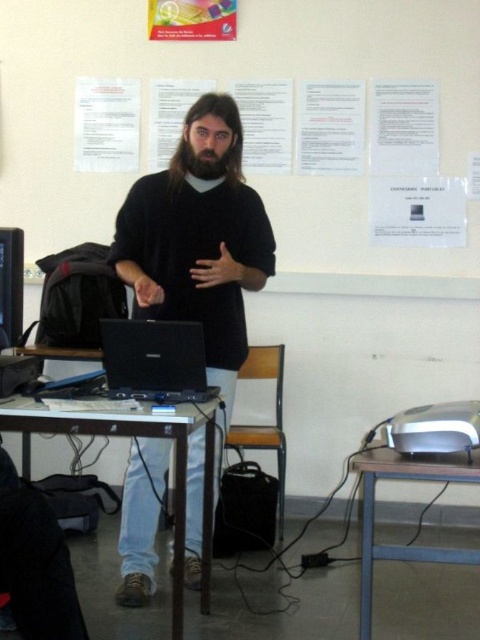
Can you confirm if wooden table at center is positioned above pinkish skin hand at center?

Actually, wooden table at center is below pinkish skin hand at center.

This screenshot has height=640, width=480. I want to click on wooden table at center, so click(140, 438).

Does metallic silver table at lower right have a larger size compared to black matte hand at center?

Yes.

Is point (394, 547) positioned in front of point (240, 275)?

That is True.

This screenshot has width=480, height=640. I want to click on metallic silver table at lower right, so click(x=373, y=513).

Which is behind, point (367, 579) or point (227, 156)?

Positioned behind is point (227, 156).

Looking at this image, who is positioned more to the right, metallic silver table at lower right or dark brown fuzzy beard at center?

Positioned to the right is metallic silver table at lower right.

Who is more distant from viewer, (x=436, y=470) or (x=210, y=170)?

Positioned behind is point (x=210, y=170).

You are a GUI agent. You are given a task and a screenshot of the screen. Output one action in this format:
    pyautogui.click(x=<x>, y=<y>)
    Task: Click on the metallic silver table at lower right
    This screenshot has height=640, width=480.
    Given the screenshot: What is the action you would take?
    pyautogui.click(x=373, y=513)